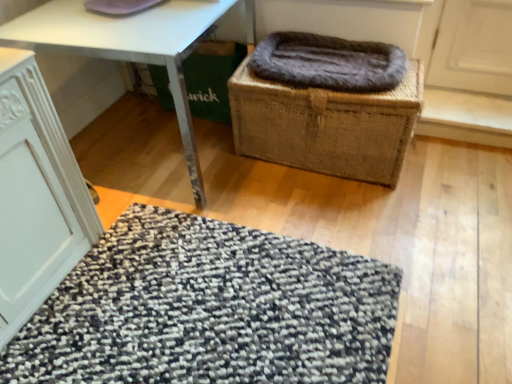
In order to click on vacant region under white glossy table at center (from a real-world perspective) in this screenshot , I will do `click(153, 147)`.